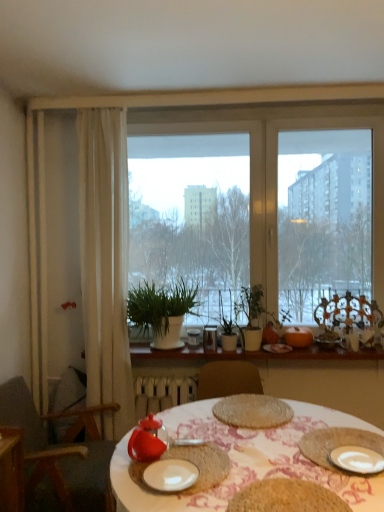
Question: In the image, is wooden chair at left positioned in front of or behind white ceramic plate at lower right, the second plate from the left?

Choices:
 (A) front
 (B) behind

Answer: (B)

Question: Based on their positions, is wooden chair at left located to the left or right of white ceramic plate at lower right, the 1th plate from the right?

Choices:
 (A) right
 (B) left

Answer: (B)

Question: Which of these objects is positioned farthest from the green matte plant at center?

Choices:
 (A) transparent glass window at center
 (B) wooden chair at left
 (C) transparent glass teapot at lower left, the fifth tableware in the right-to-left sequence
 (D) matte glass bowl at right, which is the first tableware in right-to-left order
 (E) matte red teapot at center, which is counted as the 4th tableware, starting from the right

Answer: (E)

Question: Considering the real-world distances, which object is farthest from the orange matte pumpkin at right, positioned as the 5th tableware in front-to-back order?

Choices:
 (A) white ceramic plate at lower right, the 1th plate from the right
 (B) white matte plate at center, the first plate when ordered from left to right
 (C) green matte plant at center
 (D) transparent glass window at center
 (E) matte orange pumpkin at center, positioned as the 3th tableware in right-to-left order

Answer: (B)